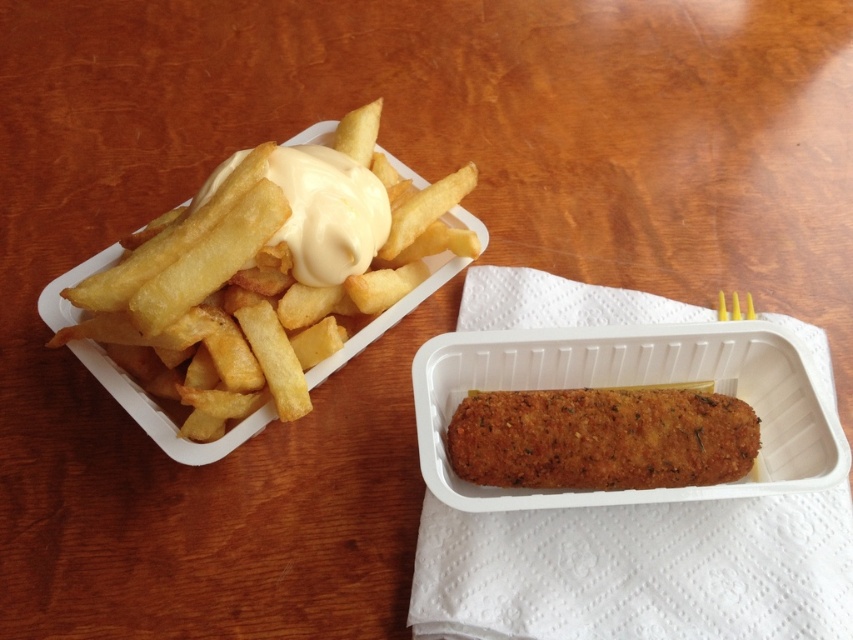
Can you confirm if golden crispy french fries at left is shorter than golden crispy croquette at center?

No, golden crispy french fries at left is not shorter than golden crispy croquette at center.

Is point (218, 413) farther from camera compared to point (622, 403)?

No, it is in front of (622, 403).

The image size is (853, 640). In order to click on golden crispy french fries at left in this screenshot , I will do `click(265, 273)`.